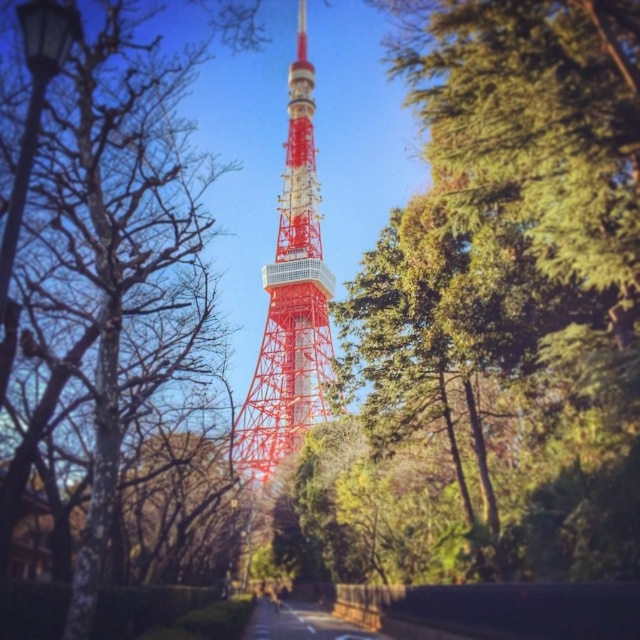
You are an architect evaluating the spatial relationship between the red painted metal tower at center and the bare wood tree at left in the image. Which structure is taller?

The red painted metal tower at center has a lesser height compared to the bare wood tree at left, so the bare wood tree at left is taller.

You are a photographer planning to capture a photo of the red painted metal tower at center and the bare wood tree at left. Based on their sizes in the image, which object would appear larger in your photo?

The bare wood tree at left appears larger in the photo because the red painted metal tower at center is smaller than it.

You are a drone operator planning to fly a drone from the base of the bare wood tree at left to the base of the red painted metal tower at center. The drone has a maximum flight distance of 25 meters. Will the drone be able to reach the tower?

The red painted metal tower at center is 25.98 meters from the bare wood tree at left. Since the drone has a maximum flight distance of 25 meters, it will not be able to reach the tower as the distance exceeds its limit by 0.98 meters.